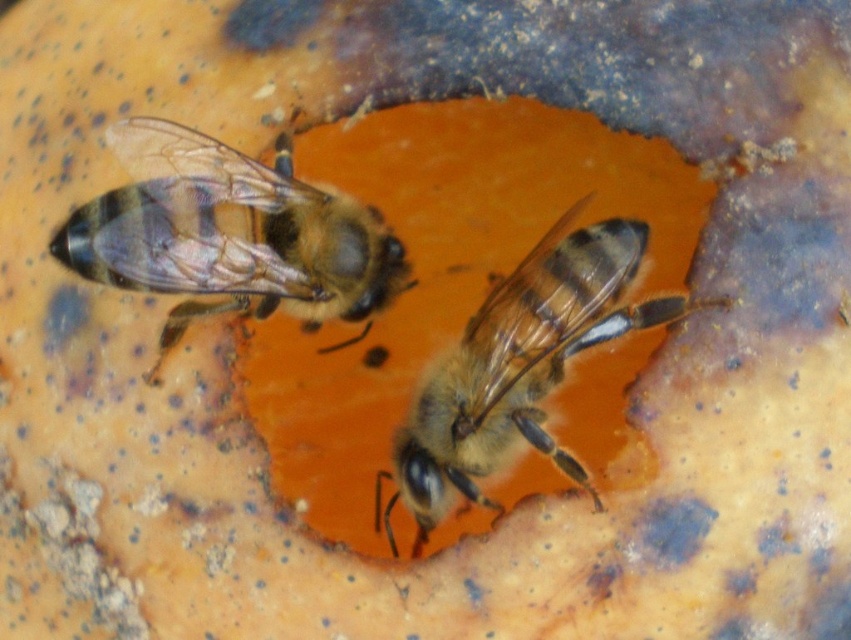
Question: Is translucent brown bee at upper left in front of translucent golden honeybee at center?

Choices:
 (A) yes
 (B) no

Answer: (A)

Question: Considering the relative positions of translucent brown bee at upper left and translucent golden honeybee at center in the image provided, where is translucent brown bee at upper left located with respect to translucent golden honeybee at center?

Choices:
 (A) left
 (B) right

Answer: (A)

Question: Which point appears closest to the camera in this image?

Choices:
 (A) (147, 184)
 (B) (610, 244)

Answer: (A)

Question: Which object appears closest to the camera in this image?

Choices:
 (A) translucent golden honeybee at center
 (B) translucent brown bee at upper left

Answer: (B)

Question: Which point is closer to the camera?

Choices:
 (A) (237, 291)
 (B) (424, 396)

Answer: (A)

Question: Does translucent brown bee at upper left have a larger size compared to translucent golden honeybee at center?

Choices:
 (A) no
 (B) yes

Answer: (A)